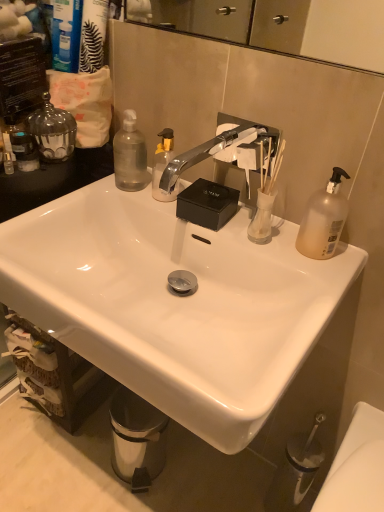
This screenshot has width=384, height=512. I want to click on vacant region to the left of stainless steel trash can at lower left, so pyautogui.click(x=78, y=456).